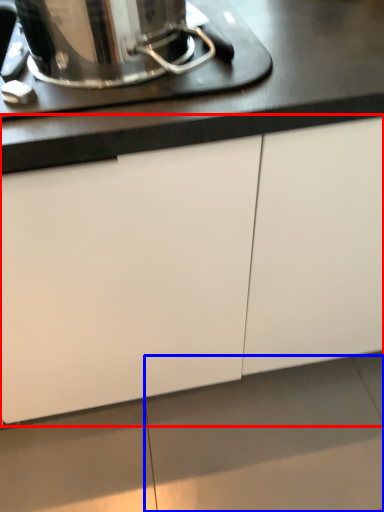
Question: Which of the following is the farthest to the observer, cabinetry (highlighted by a red box) or tile (highlighted by a blue box)?

Choices:
 (A) cabinetry
 (B) tile

Answer: (B)